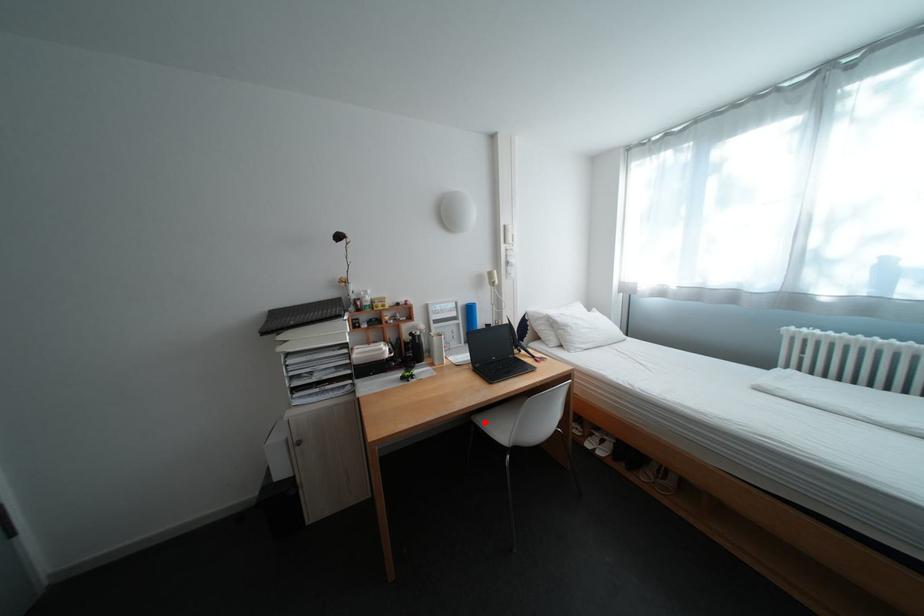
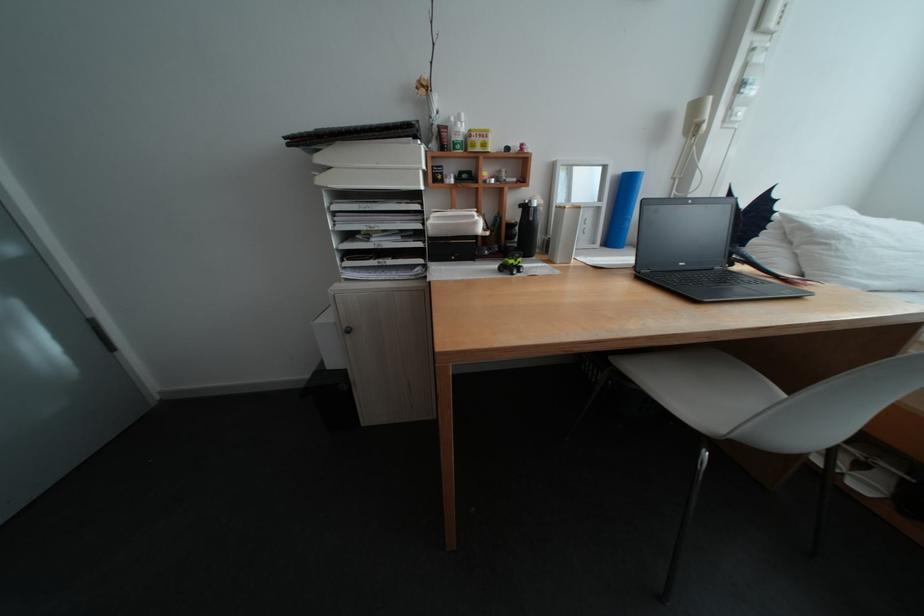
Question: I am providing you with two images of the same scene from different viewpoints. A red point is shown in image1. For the corresponding object point in image2, is it positioned nearer or farther from the camera?

Choices:
 (A) Nearer
 (B) Farther

Answer: (A)